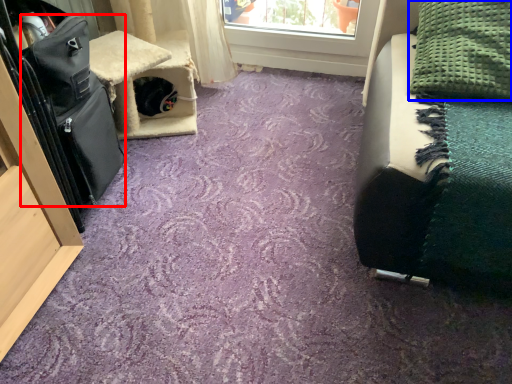
Question: Which object appears farthest to the camera in this image, luggage (highlighted by a red box) or blanket (highlighted by a blue box)?

Choices:
 (A) luggage
 (B) blanket

Answer: (B)